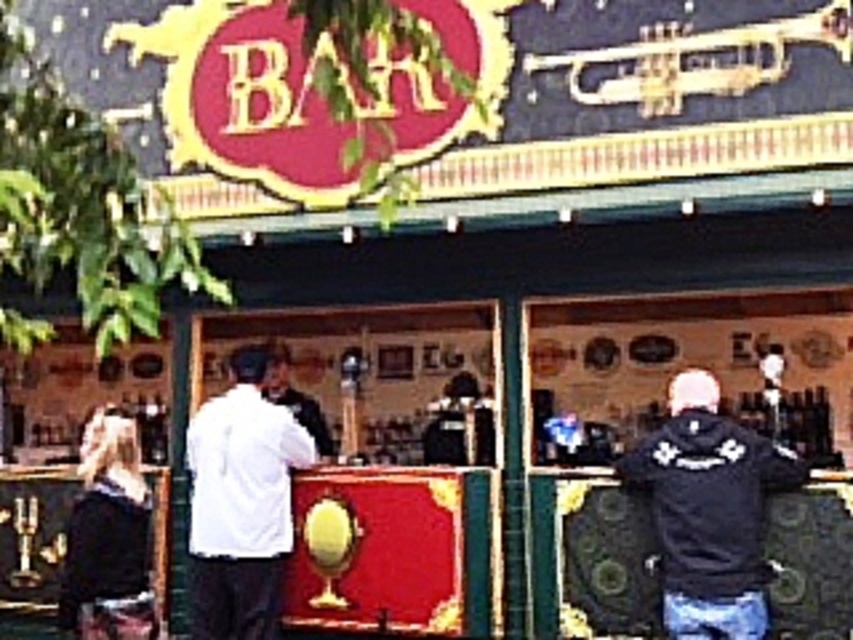
Question: Which object is closer to the camera taking this photo?

Choices:
 (A) gold brass trumpet at upper right
 (B) black matte jacket at right
 (C) white matte shirt at center

Answer: (B)

Question: Does gold brass trumpet at upper right appear on the right side of dark blue sweater at lower left?

Choices:
 (A) yes
 (B) no

Answer: (A)

Question: Can you confirm if white matte shirt at center is positioned below gold brass trumpet at upper right?

Choices:
 (A) yes
 (B) no

Answer: (A)

Question: Does white matte shirt at center appear on the left side of dark blue sweater at lower left?

Choices:
 (A) no
 (B) yes

Answer: (A)

Question: Among these points, which one is nearest to the camera?

Choices:
 (A) (91, 444)
 (B) (717, 60)

Answer: (B)

Question: Among these points, which one is nearest to the camera?

Choices:
 (A) (247, 502)
 (B) (614, 80)
 (C) (97, 483)

Answer: (B)